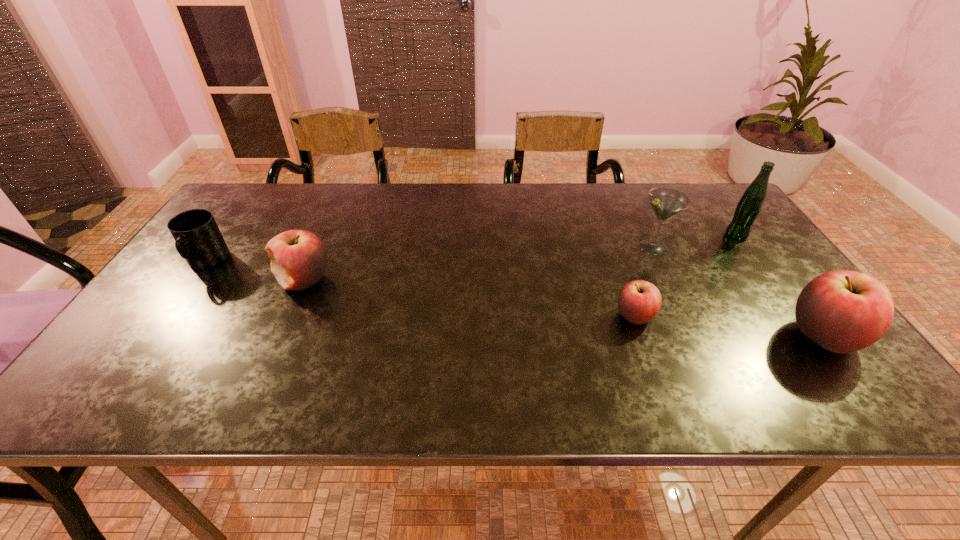
Locate an element on the screen. Image resolution: width=960 pixels, height=540 pixels. free location at the far edge is located at coordinates (607, 183).

In the image, there is a desktop. Where is `vacant space at the near edge`? This screenshot has width=960, height=540. vacant space at the near edge is located at coordinates (587, 353).

At what (x,y) coordinates should I click in order to perform the action: click on free space at the left edge of the desktop. Please return your answer as a coordinate pair (x, y). Looking at the image, I should click on (236, 240).

The width and height of the screenshot is (960, 540). In order to click on free space at the right edge in this screenshot , I will do `click(748, 240)`.

Where is `vacant space at the far left corner of the desktop`? This screenshot has height=540, width=960. vacant space at the far left corner of the desktop is located at coordinates (234, 193).

You are a GUI agent. You are given a task and a screenshot of the screen. Output one action in this format:
    pyautogui.click(x=<x>, y=<y>)
    Task: Click on the free space at the far right corner of the desktop
    This screenshot has width=960, height=540.
    Given the screenshot: What is the action you would take?
    pyautogui.click(x=708, y=201)

Locate an element on the screen. empty space that is in between the mug and the fourth object from left to right is located at coordinates (430, 255).

Find the location of a particular element. The width and height of the screenshot is (960, 540). blank region between the mug and the fourth object from left to right is located at coordinates (430, 255).

The image size is (960, 540). I want to click on vacant area that lies between the beer bottle and the third object from right to left, so click(x=694, y=241).

The width and height of the screenshot is (960, 540). In order to click on unoccupied position between the shortest object and the rightmost apple in this screenshot , I will do `click(729, 327)`.